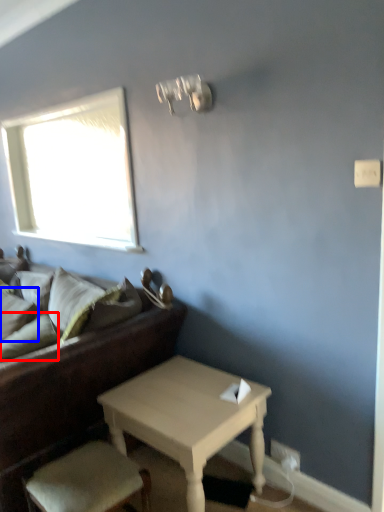
Question: Among these objects, which one is nearest to the camera, pillow (highlighted by a red box) or pillow (highlighted by a blue box)?

Choices:
 (A) pillow
 (B) pillow

Answer: (A)